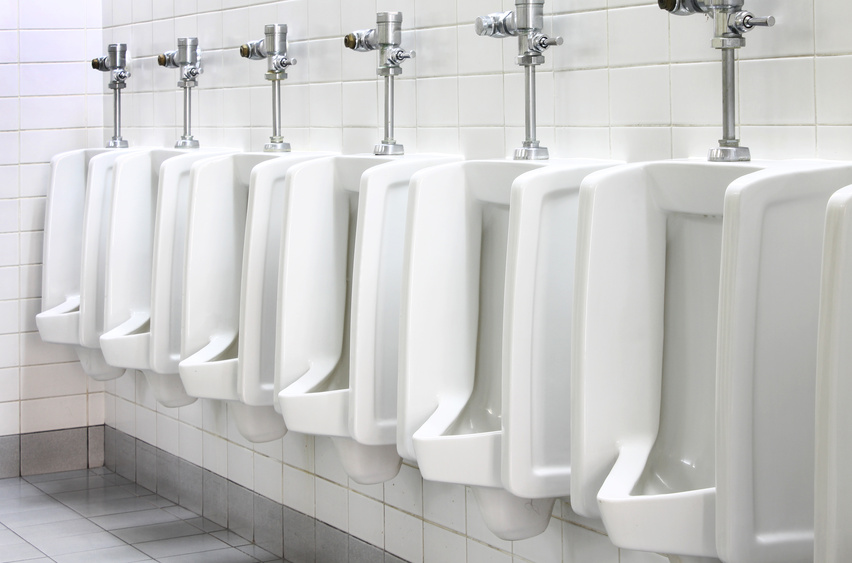
The width and height of the screenshot is (852, 563). Identify the location of flush handle. (122, 88), (190, 83), (280, 56), (399, 50), (554, 39), (753, 19).